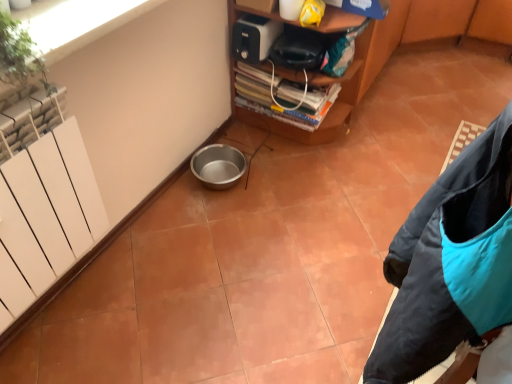
Find the location of a particular element. The height and width of the screenshot is (384, 512). white plastic toaster at upper center is located at coordinates (254, 37).

Identify the location of green leafy plant at upper left. Image resolution: width=512 pixels, height=384 pixels. (19, 57).

This screenshot has height=384, width=512. Find the location of `jacket in front of the white matte radiator at left`. jacket in front of the white matte radiator at left is located at coordinates (446, 264).

Is teal synthetic jacket at lower right oriented away from white matte radiator at left?

Yes, teal synthetic jacket at lower right's orientation is away from white matte radiator at left.

Does point (483, 321) appear closer or farther from the camera than point (73, 200)?

Clearly, point (483, 321) is closer to the camera than point (73, 200).

Between teal synthetic jacket at lower right and white matte radiator at left, which one appears on the right side from the viewer's perspective?

Positioned to the right is teal synthetic jacket at lower right.

Is metallic silver bowl at lower left not near white plastic toaster at upper center?

Actually, metallic silver bowl at lower left and white plastic toaster at upper center are a little close together.

In the image, is metallic silver bowl at lower left positioned in front of or behind white plastic toaster at upper center?

In the image, metallic silver bowl at lower left appears in front of white plastic toaster at upper center.

Considering the positions of points (336, 103) and (242, 52), is point (336, 103) closer to camera compared to point (242, 52)?

No, it is not.

Can white plastic toaster at upper center be found inside white matte radiator at left?

No, white plastic toaster at upper center is located outside of white matte radiator at left.

Consider the image. From a real-world perspective, is white matte radiator at left under white plastic toaster at upper center?

Indeed, from a real-world perspective, white matte radiator at left is positioned beneath white plastic toaster at upper center.

From the image's perspective, relative to white plastic toaster at upper center, is white matte radiator at left above or below?

From the image's perspective, white matte radiator at left appears below white plastic toaster at upper center.

Looking at this image, which object is further away from the camera taking this photo, white matte radiator at left or white plastic toaster at upper center?

white plastic toaster at upper center is behind.

Would you say metallic silver bowl at lower left is to the left or to the right of white matte radiator at left in the picture?

In the image, metallic silver bowl at lower left appears on the right side of white matte radiator at left.

Does point (351, 97) come closer to viewer compared to point (41, 219)?

No, (351, 97) is behind (41, 219).

Is metallic silver bowl at lower left oriented towards white matte radiator at left?

No, metallic silver bowl at lower left does not turn towards white matte radiator at left.

Based on the photo, considering the sizes of white matte radiator at left and metallic silver bowl at lower left in the image, is white matte radiator at left wider or thinner than metallic silver bowl at lower left?

white matte radiator at left is thinner than metallic silver bowl at lower left.

From the image's perspective, is white matte radiator at left under metallic silver bowl at lower left?

Yes.

Is white matte radiator at left beside metallic silver bowl at lower left?

white matte radiator at left is not next to metallic silver bowl at lower left, and they're not touching.

From a real-world perspective, between white matte radiator at left and teal synthetic jacket at lower right, who is vertically higher?

teal synthetic jacket at lower right is physically above.

Looking at this image, is white matte radiator at left inside the boundaries of teal synthetic jacket at lower right, or outside?

white matte radiator at left cannot be found inside teal synthetic jacket at lower right.

Is white matte radiator at left with teal synthetic jacket at lower right?

No, white matte radiator at left is not touching teal synthetic jacket at lower right.

Considering the points (31, 202) and (435, 256), which point is behind, point (31, 202) or point (435, 256)?

The point (31, 202) is farther from the camera.

Considering the relative sizes of white plastic toaster at upper center and green leafy plant at upper left in the image provided, is white plastic toaster at upper center smaller than green leafy plant at upper left?

Yes.

This screenshot has height=384, width=512. Find the location of `appliance directly beneath the green leafy plant at upper left (from a real-world perspective)`. appliance directly beneath the green leafy plant at upper left (from a real-world perspective) is located at coordinates (254, 37).

Is white plastic toaster at upper center outside of green leafy plant at upper left?

white plastic toaster at upper center is positioned outside green leafy plant at upper left.

Does point (245, 60) appear closer or farther from the camera than point (3, 72)?

Point (245, 60).

Find the location of a particular element. The height and width of the screenshot is (384, 512). jacket below the white matte radiator at left (from the image's perspective) is located at coordinates (446, 264).

Find the location of a particular element. The width and height of the screenshot is (512, 384). appliance located behind the metallic silver bowl at lower left is located at coordinates (254, 37).

When comparing their distances from metallic silver bowl at lower left, does teal synthetic jacket at lower right or white plastic toaster at upper center seem closer?

Based on the image, white plastic toaster at upper center appears to be nearer to metallic silver bowl at lower left.

When comparing their distances from white matte radiator at left, does white plastic toaster at upper center or metallic silver bowl at lower left seem further?

metallic silver bowl at lower left.

From the image, which object appears to be nearer to teal synthetic jacket at lower right, white plastic toaster at upper center or metallic silver bowl at lower left?

metallic silver bowl at lower left lies closer to teal synthetic jacket at lower right than the other object.

Based on their spatial positions, is teal synthetic jacket at lower right or metallic silver bowl at lower left closer to white matte radiator at left?

Among the two, teal synthetic jacket at lower right is located nearer to white matte radiator at left.

Based on their spatial positions, is white plastic toaster at upper center or white matte radiator at left closer to green leafy plant at upper left?

Based on the image, white matte radiator at left appears to be nearer to green leafy plant at upper left.

From the picture: Considering their positions, is metallic silver bowl at lower left positioned further to teal synthetic jacket at lower right than green leafy plant at upper left?

metallic silver bowl at lower left.

Which object lies further to the anchor point metallic silver bowl at lower left, white matte radiator at left or teal synthetic jacket at lower right?

Among the two, teal synthetic jacket at lower right is located further to metallic silver bowl at lower left.

When comparing their distances from green leafy plant at upper left, does white plastic toaster at upper center or teal synthetic jacket at lower right seem further?

white plastic toaster at upper center lies further to green leafy plant at upper left than the other object.

Where is `furniture between white matte radiator at left and teal synthetic jacket at lower right in the horizontal direction`? furniture between white matte radiator at left and teal synthetic jacket at lower right in the horizontal direction is located at coordinates (344, 80).

Identify the location of furniture between white matte radiator at left and white plastic toaster at upper center in the front-back direction. (344, 80).

Image resolution: width=512 pixels, height=384 pixels. In order to click on furniture between green leafy plant at upper left and white plastic toaster at upper center in the front-back direction in this screenshot , I will do `click(344, 80)`.

Locate an element on the screen. This screenshot has width=512, height=384. plant between white matte radiator at left and white plastic toaster at upper center from front to back is located at coordinates (19, 57).